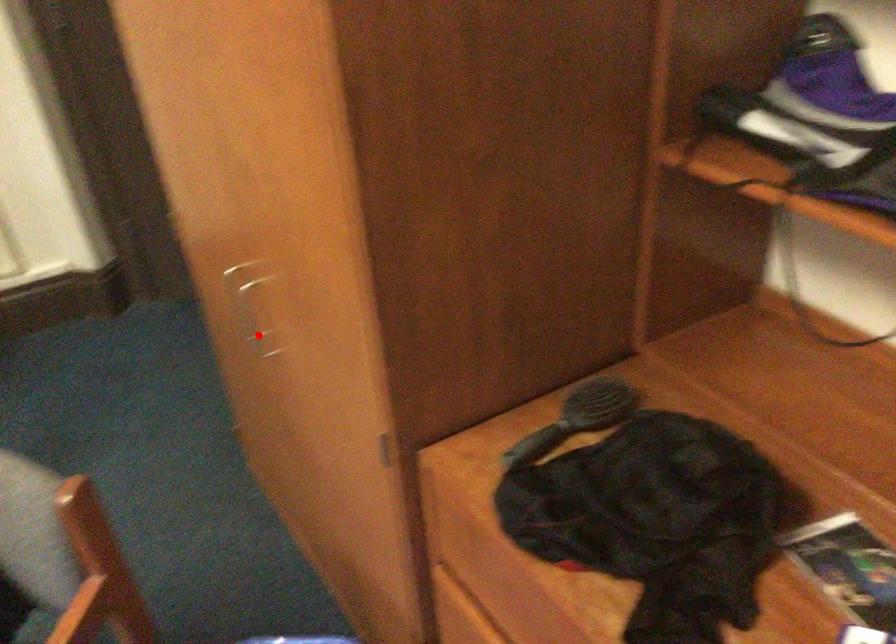
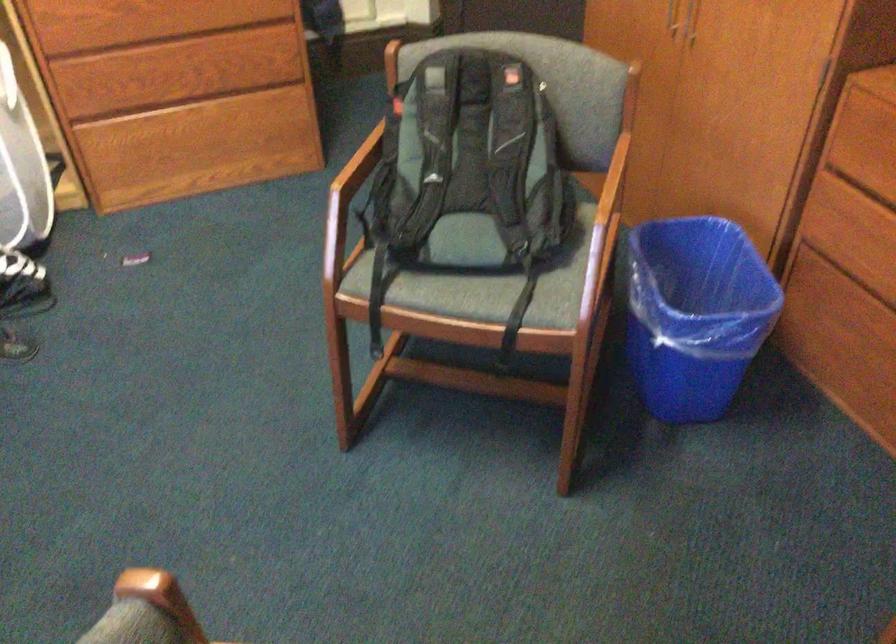
Question: A red point is marked in image1. In image2, is the corresponding 3D point closer to the camera or farther? Reply with the corresponding letter.

Choices:
 (A) The corresponding 3D point is closer.
 (B) The corresponding 3D point is farther.

Answer: (B)